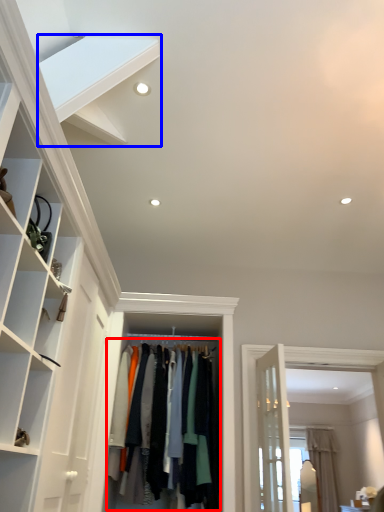
Question: Which object appears closest to the camera in this image, clothing (highlighted by a red box) or stairs (highlighted by a blue box)?

Choices:
 (A) clothing
 (B) stairs

Answer: (B)